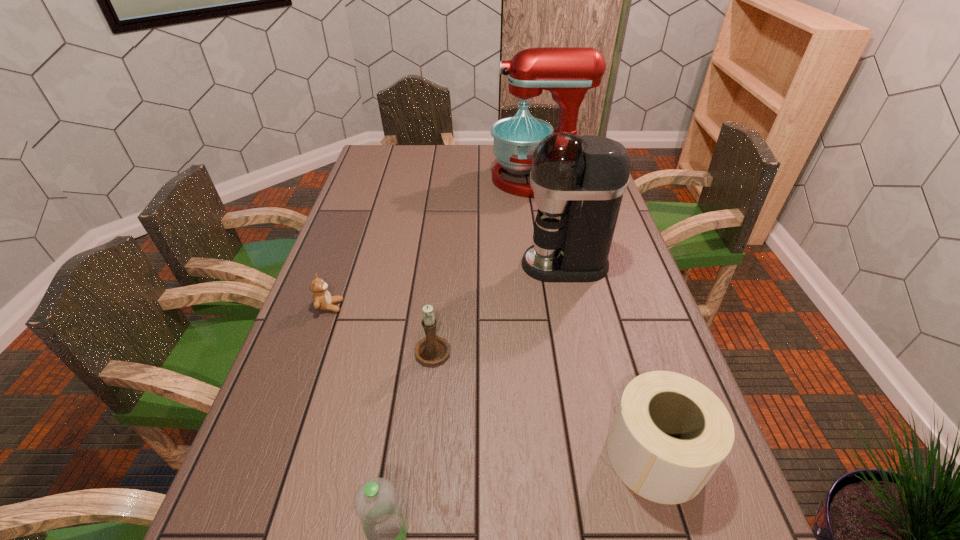
The image size is (960, 540). I want to click on mixer present at the right edge, so click(x=567, y=72).

The image size is (960, 540). I want to click on coffee maker at the right edge, so click(x=578, y=182).

Identify the location of toilet tissue present at the right edge. Image resolution: width=960 pixels, height=540 pixels. (670, 433).

Where is `object located at the far right corner`? The image size is (960, 540). object located at the far right corner is located at coordinates (567, 72).

What are the coordinates of `free space at the far edge` in the screenshot? It's located at (463, 150).

Image resolution: width=960 pixels, height=540 pixels. What are the coordinates of `vacant space at the left edge` in the screenshot? It's located at (387, 179).

The height and width of the screenshot is (540, 960). I want to click on vacant space at the right edge of the desktop, so click(704, 522).

This screenshot has height=540, width=960. Identify the location of vacant area that lies between the fifth shortest object and the candle holder. (499, 307).

I want to click on vacant point located between the toilet tissue and the leftmost object, so click(x=492, y=381).

Where is `free spot between the shortest object and the candle holder`? This screenshot has width=960, height=540. free spot between the shortest object and the candle holder is located at coordinates (381, 328).